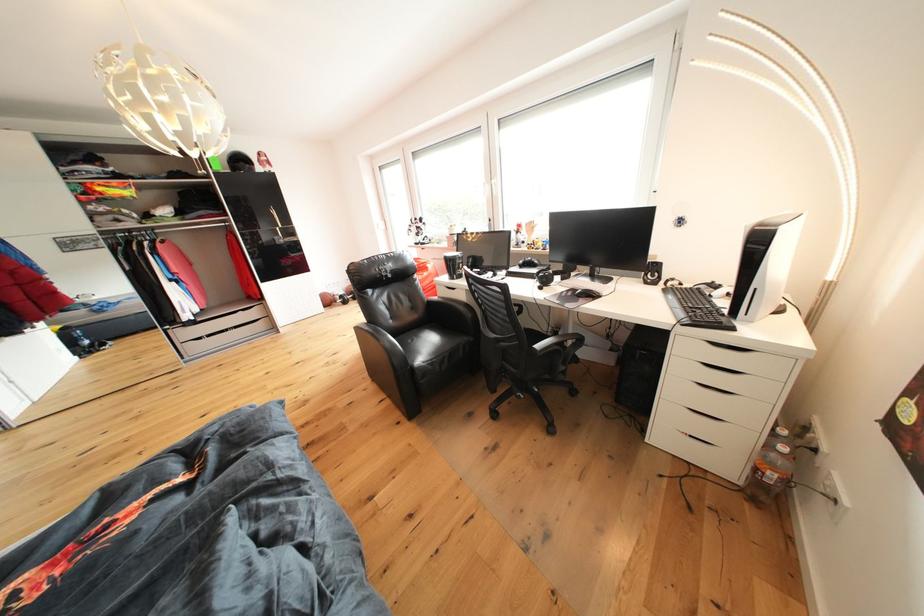
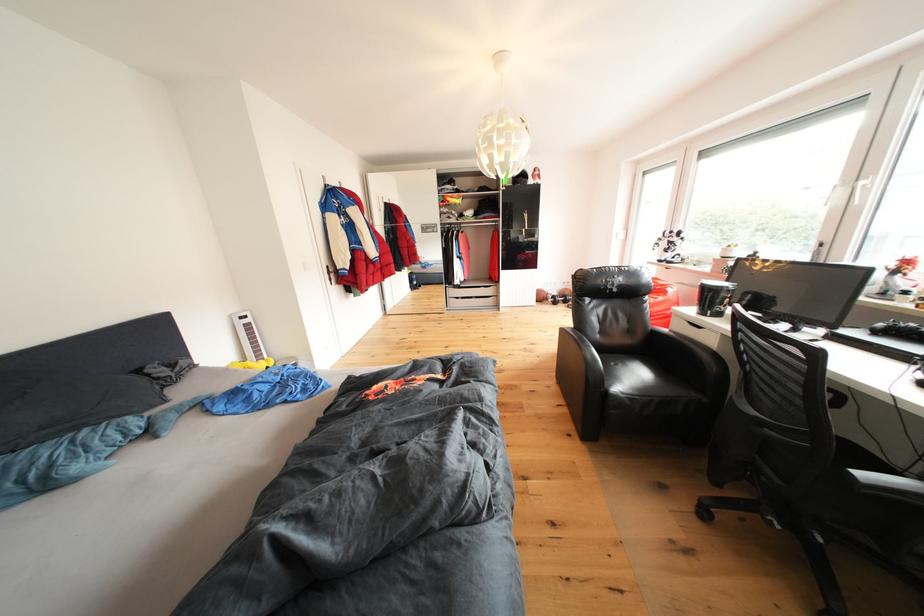
Locate, in the second image, the point that corresponds to point (205, 315) in the first image.

(470, 284)